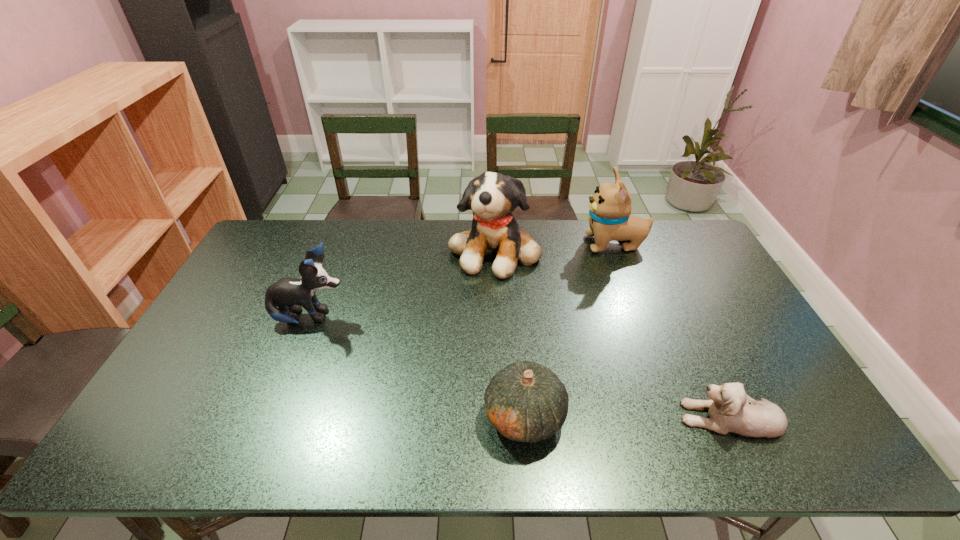
Where is `free space located on the front-facing side of the shortest object`? This screenshot has width=960, height=540. free space located on the front-facing side of the shortest object is located at coordinates (547, 417).

The image size is (960, 540). Find the location of `vacant space located 0.200m on the front-facing side of the shortest object`. vacant space located 0.200m on the front-facing side of the shortest object is located at coordinates (597, 417).

This screenshot has width=960, height=540. I want to click on gourd positioned at the near edge, so click(525, 401).

Locate an element on the screen. This screenshot has width=960, height=540. puppy present at the near edge is located at coordinates (730, 409).

The height and width of the screenshot is (540, 960). I want to click on object that is at the right edge, so click(x=730, y=409).

The width and height of the screenshot is (960, 540). I want to click on object that is at the near right corner, so click(730, 409).

Locate an element on the screen. Image resolution: width=960 pixels, height=540 pixels. free point at the far edge is located at coordinates (371, 247).

At what (x,y) coordinates should I click in order to perform the action: click on blank space at the near edge of the desktop. Please return your answer as a coordinate pair (x, y). Image resolution: width=960 pixels, height=540 pixels. Looking at the image, I should click on (640, 449).

Locate an element on the screen. Image resolution: width=960 pixels, height=540 pixels. vacant space at the left edge is located at coordinates (240, 313).

You are a GUI agent. You are given a task and a screenshot of the screen. Output one action in this format:
    pyautogui.click(x=<x>, y=<y>)
    Task: Click on the vacant space at the right edge of the desktop
    This screenshot has height=540, width=960.
    Given the screenshot: What is the action you would take?
    coord(716,339)